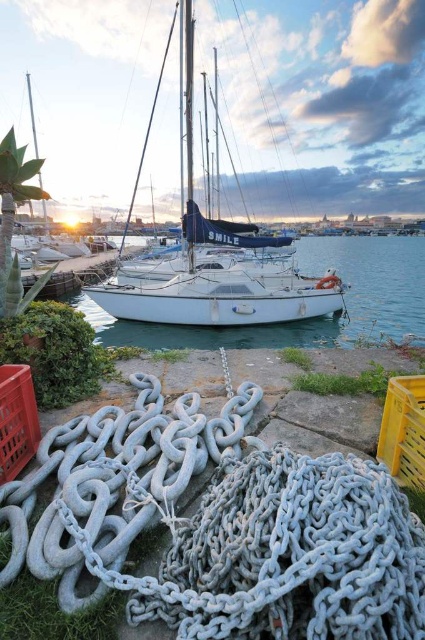
Question: Considering the real-world distances, which object is farthest from the orange plastic crate at lower left?

Choices:
 (A) galvanized metal chain at lower center
 (B) metallic mast at upper center
 (C) white matte sailboat at center

Answer: (B)

Question: Does galvanized metal chain at lower center have a smaller size compared to orange plastic crate at lower left?

Choices:
 (A) no
 (B) yes

Answer: (A)

Question: Can you confirm if galvanized metal chain at lower center is positioned to the left of metallic mast at upper center?

Choices:
 (A) yes
 (B) no

Answer: (B)

Question: Which object is closer to the camera taking this photo?

Choices:
 (A) white matte water at center
 (B) white matte sailboat at center
 (C) yellow plastic crate at lower right

Answer: (C)

Question: From the image, what is the correct spatial relationship of galvanized metal chain at lower center in relation to orange plastic crate at lower left?

Choices:
 (A) left
 (B) right

Answer: (B)

Question: Estimate the real-world distances between objects in this image. Which object is farther from the white matte water at center?

Choices:
 (A) metallic mast at upper center
 (B) yellow plastic crate at lower right

Answer: (A)